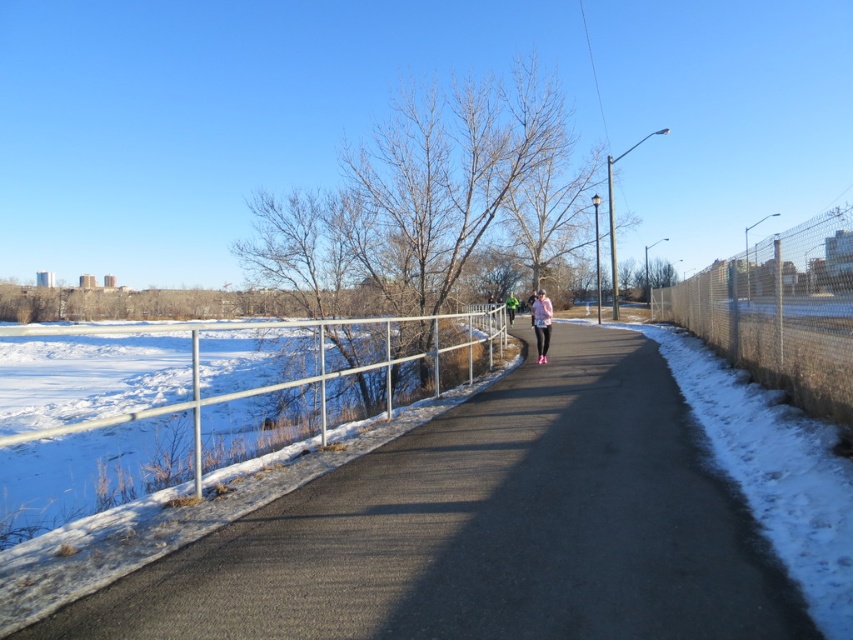
Is asphalt road at center above pink fabric pants at center?

No, asphalt road at center is not above pink fabric pants at center.

At what (x,y) coordinates should I click in order to perform the action: click on asphalt road at center. Please return your answer as a coordinate pair (x, y). This screenshot has height=640, width=853. Looking at the image, I should click on [486, 529].